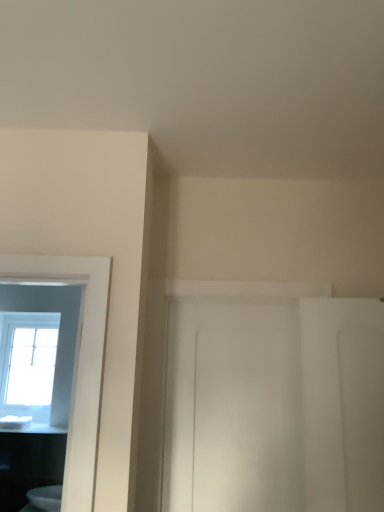
Question: Is clear glass window at left touching white glossy countertop at lower left?

Choices:
 (A) yes
 (B) no

Answer: (B)

Question: Is clear glass window at left wider than white glossy countertop at lower left?

Choices:
 (A) yes
 (B) no

Answer: (B)

Question: From the image's perspective, would you say clear glass window at left is positioned over white glossy countertop at lower left?

Choices:
 (A) no
 (B) yes

Answer: (B)

Question: Is white glossy countertop at lower left inside clear glass window at left?

Choices:
 (A) yes
 (B) no

Answer: (B)

Question: From a real-world perspective, does clear glass window at left stand above white glossy countertop at lower left?

Choices:
 (A) yes
 (B) no

Answer: (A)

Question: In terms of size, does white glossy toilet at lower left appear bigger or smaller than white glossy countertop at lower left?

Choices:
 (A) small
 (B) big

Answer: (B)

Question: Visually, is white glossy toilet at lower left positioned to the left or to the right of white glossy countertop at lower left?

Choices:
 (A) left
 (B) right

Answer: (B)

Question: Is white glossy toilet at lower left wider or thinner than white glossy countertop at lower left?

Choices:
 (A) thin
 (B) wide

Answer: (A)

Question: In terms of height, does white glossy toilet at lower left look taller or shorter compared to white glossy countertop at lower left?

Choices:
 (A) tall
 (B) short

Answer: (A)

Question: In the image, is white glossy toilet at lower left on the left side or the right side of clear glass window at left?

Choices:
 (A) left
 (B) right

Answer: (B)

Question: In the image, is white glossy toilet at lower left positioned in front of or behind clear glass window at left?

Choices:
 (A) front
 (B) behind

Answer: (A)

Question: From the image's perspective, is white glossy toilet at lower left located above or below clear glass window at left?

Choices:
 (A) above
 (B) below

Answer: (B)

Question: Is white glossy toilet at lower left taller or shorter than clear glass window at left?

Choices:
 (A) short
 (B) tall

Answer: (A)

Question: Would you say clear glass window at left is inside or outside white glossy toilet at lower left?

Choices:
 (A) outside
 (B) inside

Answer: (A)

Question: Considering the positions of point (4, 353) and point (46, 501), is point (4, 353) closer or farther from the camera than point (46, 501)?

Choices:
 (A) farther
 (B) closer

Answer: (A)